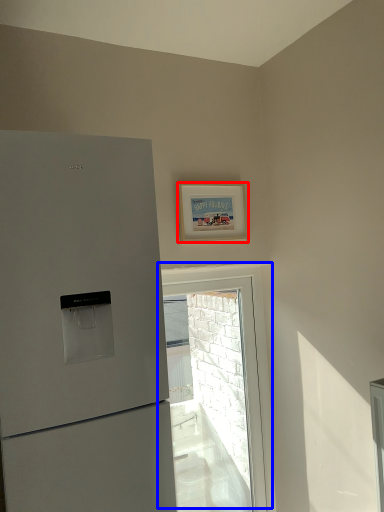
Question: Which point is closer to the camera, picture frame (highlighted by a red box) or window (highlighted by a blue box)?

Choices:
 (A) picture frame
 (B) window

Answer: (A)